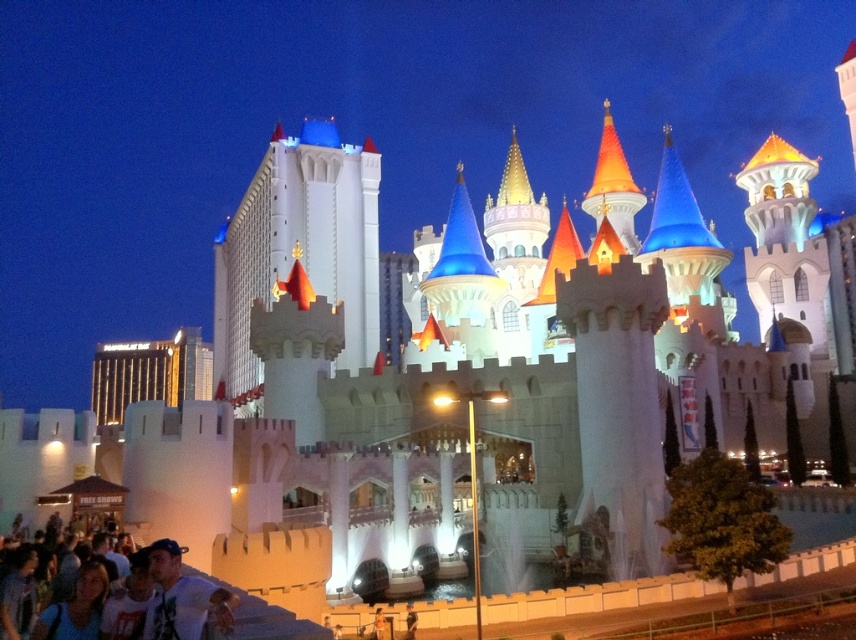
Based on the photo, you are standing at the entrance of the theme park and want to take a photo of the white stone castle at center. If your camera has a zoom lens that can focus on objects within a 0.3 to 0.45 coordinate range on the horizontal axis, will the castle be within the focus range?

The white stone castle at center is positioned at point 0.384 on the horizontal axis, which falls within the 0.3 to 0.45 coordinate range, so it will be within the focus range.